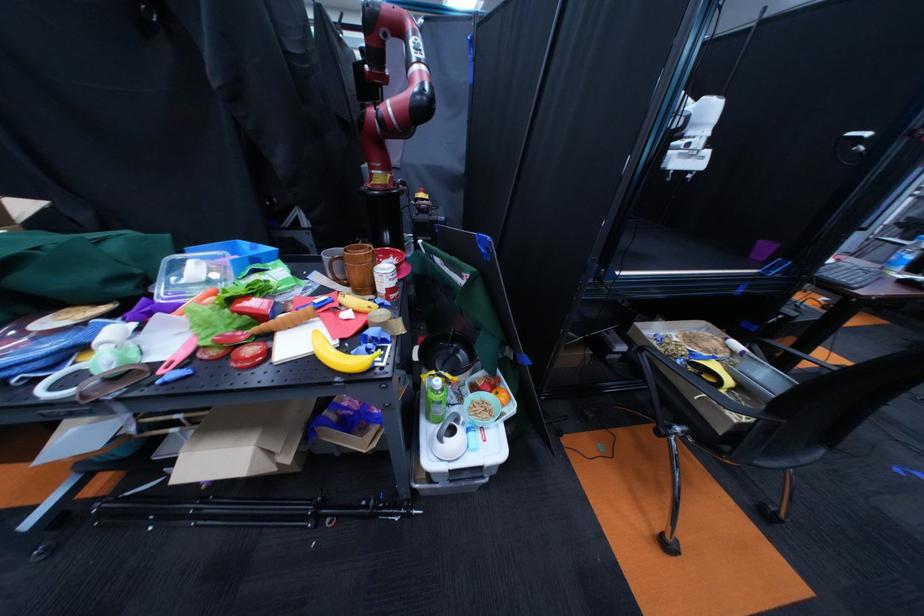
The location [190,275] corresponds to which object?

It corresponds to the clear water bottle in the image.